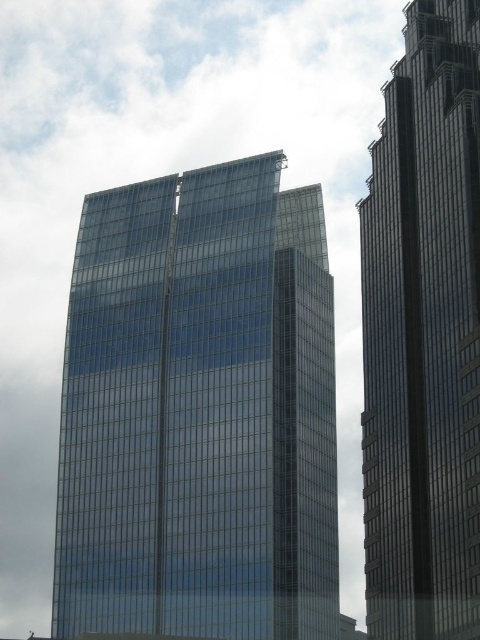
Which is below, transparent glass building at center or glassy steel skyscraper at right?

Positioned lower is transparent glass building at center.

Is transparent glass building at center further to camera compared to glassy steel skyscraper at right?

That is True.

I want to click on transparent glass building at center, so click(200, 412).